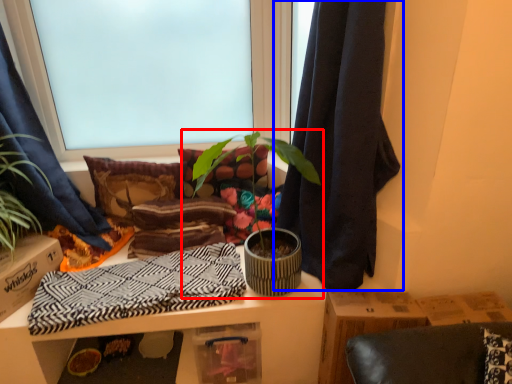
Question: Which of the following is the closest to the observer, houseplant (highlighted by a red box) or curtain (highlighted by a blue box)?

Choices:
 (A) houseplant
 (B) curtain

Answer: (B)